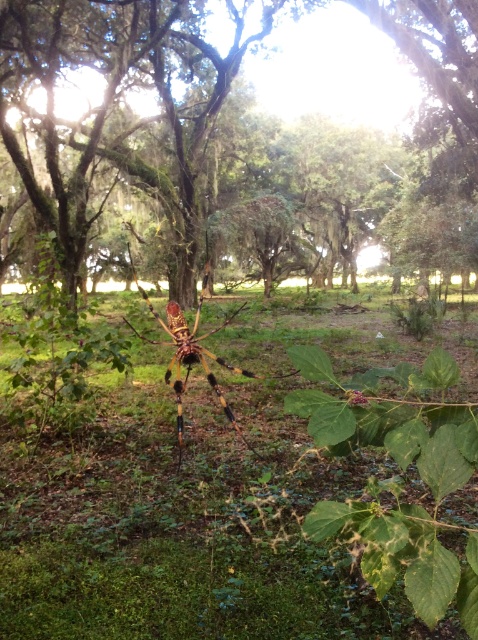
You are standing in the forest and want to walk from point A to point B. Point A is at coordinates point (209, 112) and point B is at coordinates point (228, 412). Which point is closer to you when you start walking?

Point A at coordinates point (209, 112) is closer to you than point B at coordinates point (228, 412) because it is further to the viewer.